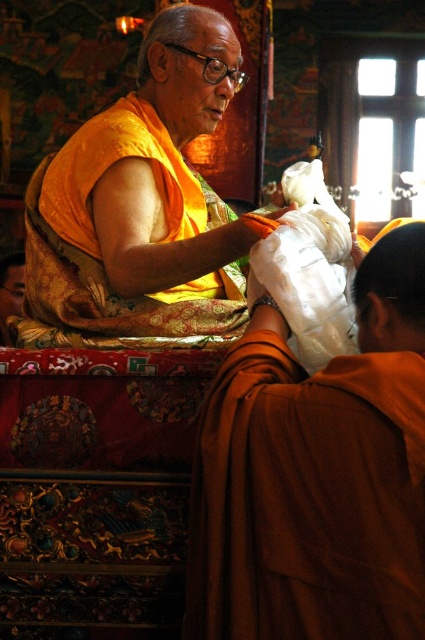
You are an interior designer observing the temple scene. You need to determine which robe, the orange silk robe at center or the matte orange robe at center, is shorter in height. Which one is shorter?

The orange silk robe at center has a lesser height compared to the matte orange robe at center, so the orange silk robe at center is shorter.

You are an interior designer planning to place both the orange silk robe at center and the matte orange robe at center on a display rack. Which robe requires more space for proper display?

The matte orange robe at center requires more space for proper display because it occupies more space than the orange silk robe at center.